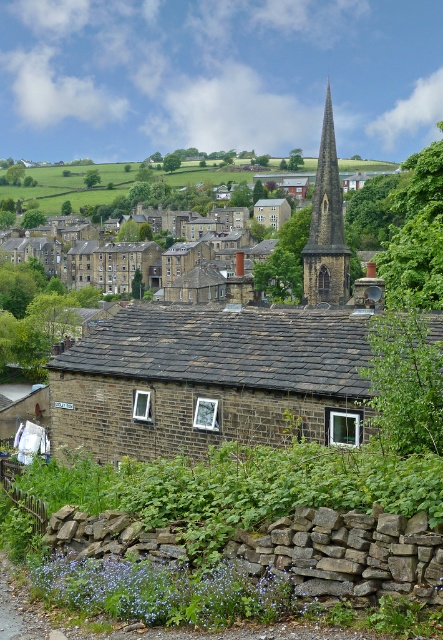
Can you confirm if brown stone church at center is thinner than dark gray stone spire at center?

Correct, brown stone church at center's width is less than dark gray stone spire at center's.

Who is more distant from viewer, (361, 378) or (321, 176)?

Positioned behind is point (321, 176).

This screenshot has height=640, width=443. I want to click on brown stone church at center, so click(212, 380).